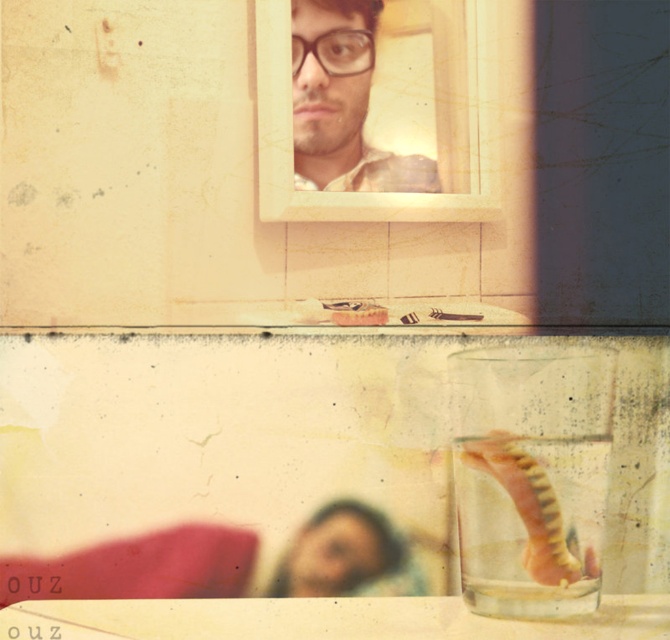
Does smooth skin selfie at lower center appear over blurred skin at lower center?

Actually, smooth skin selfie at lower center is below blurred skin at lower center.

Does smooth skin selfie at lower center have a larger size compared to blurred skin at lower center?

Correct, smooth skin selfie at lower center is larger in size than blurred skin at lower center.

What are the coordinates of `smooth skin selfie at lower center` in the screenshot? It's located at (139, 566).

How much distance is there between smooth skin selfie at lower center and matte plastic selfie at upper center?

smooth skin selfie at lower center and matte plastic selfie at upper center are 16.39 inches apart from each other.

Based on the photo, is smooth skin selfie at lower center to the left of matte plastic selfie at upper center from the viewer's perspective?

Indeed, smooth skin selfie at lower center is positioned on the left side of matte plastic selfie at upper center.

Does point (58, 564) come in front of point (310, 52)?

Yes, it is.

At what (x,y) coordinates should I click in order to perform the action: click on smooth skin selfie at lower center. Please return your answer as a coordinate pair (x, y). The image size is (670, 640). Looking at the image, I should click on (139, 566).

Does matte plastic selfie at upper center have a lesser width compared to blurred skin at lower center?

Yes.

Consider the image. Is matte plastic selfie at upper center to the right of blurred skin at lower center from the viewer's perspective?

Correct, you'll find matte plastic selfie at upper center to the right of blurred skin at lower center.

Does point (306, 72) come farther from viewer compared to point (289, 579)?

Yes, point (306, 72) is behind point (289, 579).

Identify the location of matte plastic selfie at upper center. This screenshot has height=640, width=670. (340, 102).